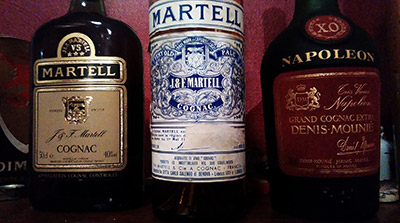
The width and height of the screenshot is (400, 223). I want to click on red bavkhround wall, so click(x=127, y=12), click(x=261, y=22), click(x=252, y=68), click(x=19, y=20).